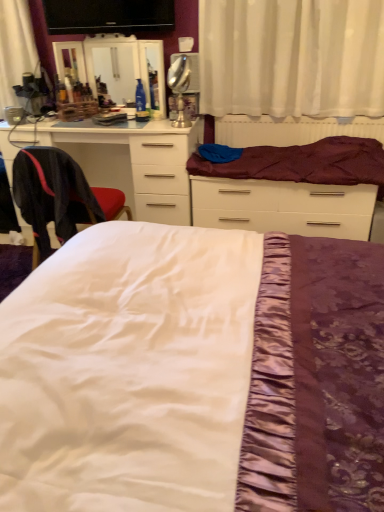
This screenshot has width=384, height=512. What do you see at coordinates (135, 163) in the screenshot? I see `white glossy chest of drawers at left` at bounding box center [135, 163].

Measure the distance between white glossy chest of drawers at left and camera.

2.46 meters.

What is the approximate width of silver metallic table lamp at upper center?

silver metallic table lamp at upper center is 4.65 inches wide.

This screenshot has height=512, width=384. Describe the element at coordinates (179, 87) in the screenshot. I see `silver metallic table lamp at upper center` at that location.

What do you see at coordinates (108, 16) in the screenshot? I see `black glossy flat-screen tv at upper center` at bounding box center [108, 16].

Find the location of `maroon satin mattress at upper center`. maroon satin mattress at upper center is located at coordinates (303, 163).

Is black glossy flat-screen tv at upper center looking in the opposite direction of silver metallic table lamp at upper center?

black glossy flat-screen tv at upper center is not turned away from silver metallic table lamp at upper center.

What's the angular difference between black glossy flat-screen tv at upper center and silver metallic table lamp at upper center's facing directions?

They differ by 62.4 degrees in their facing directions.

Can you confirm if black glossy flat-screen tv at upper center is shorter than silver metallic table lamp at upper center?

Indeed, black glossy flat-screen tv at upper center has a lesser height compared to silver metallic table lamp at upper center.

Between black glossy flat-screen tv at upper center and black fabric chair at left, which one appears on the right side from the viewer's perspective?

From the viewer's perspective, black glossy flat-screen tv at upper center appears more on the right side.

Considering the relative sizes of black glossy flat-screen tv at upper center and black fabric chair at left in the image provided, is black glossy flat-screen tv at upper center thinner than black fabric chair at left?

Correct, the width of black glossy flat-screen tv at upper center is less than that of black fabric chair at left.

Between point (49, 4) and point (36, 158), which one is positioned in front?

The point (36, 158) is closer.

What's the angular difference between silver metallic table lamp at upper center and white satin bed at center, marked as the first bed in a front-to-back arrangement,'s facing directions?

There is a 42.7-degree angle between the facing directions of silver metallic table lamp at upper center and white satin bed at center, marked as the first bed in a front-to-back arrangement.

Does silver metallic table lamp at upper center have a smaller size compared to white satin bed at center, marked as the first bed in a front-to-back arrangement?

Indeed, silver metallic table lamp at upper center has a smaller size compared to white satin bed at center, marked as the first bed in a front-to-back arrangement.

Does point (189, 73) lie in front of point (302, 404)?

No.

Who is more distant, maroon satin mattress at upper center or white sheer curtain at upper center?

maroon satin mattress at upper center is further away from the camera.

Considering the sizes of objects maroon satin mattress at upper center and white sheer curtain at upper center in the image provided, who is taller, maroon satin mattress at upper center or white sheer curtain at upper center?

Standing taller between the two is white sheer curtain at upper center.

Is maroon satin mattress at upper center oriented towards white sheer curtain at upper center?

No.

Is maroon satin mattress at upper center not within white sheer curtain at upper center?

maroon satin mattress at upper center is positioned outside white sheer curtain at upper center.

In the scene shown: From a real-world perspective, which object rests below the other?

From a 3D spatial view, white sheer curtain at upper center is below.

Based on the photo, is white sheer curtain at upper center not within black glossy flat-screen tv at upper center?

white sheer curtain at upper center is positioned outside black glossy flat-screen tv at upper center.

Could you tell me if white sheer curtain at upper center is facing black glossy flat-screen tv at upper center?

No, white sheer curtain at upper center is not oriented towards black glossy flat-screen tv at upper center.

From the image's perspective, does white sheer curtain at upper center appear higher than black glossy flat-screen tv at upper center?

No, from the image's perspective, white sheer curtain at upper center is not over black glossy flat-screen tv at upper center.

Considering the positions of objects black glossy flat-screen tv at upper center and maroon satin mattress at upper center in the image provided, who is behind, black glossy flat-screen tv at upper center or maroon satin mattress at upper center?

black glossy flat-screen tv at upper center.

Identify the location of mattress that appears on the right of black glossy flat-screen tv at upper center. The image size is (384, 512). (303, 163).

In the scene shown: Is maroon satin mattress at upper center inside black glossy flat-screen tv at upper center?

No.

Is point (166, 22) positioned before point (246, 172)?

No.

Can you confirm if black glossy flat-screen tv at upper center is wider than white sheer curtain at upper center?

Incorrect, the width of black glossy flat-screen tv at upper center does not surpass that of white sheer curtain at upper center.

Is black glossy flat-screen tv at upper center positioned before white sheer curtain at upper center?

No, the depth of black glossy flat-screen tv at upper center is greater than that of white sheer curtain at upper center.

Is black glossy flat-screen tv at upper center touching white sheer curtain at upper center?

No, black glossy flat-screen tv at upper center is not making contact with white sheer curtain at upper center.

The height and width of the screenshot is (512, 384). I want to click on curtain below the black glossy flat-screen tv at upper center (from a real-world perspective), so click(292, 57).

You are a GUI agent. You are given a task and a screenshot of the screen. Output one action in this format:
    pyautogui.click(x=<x>, y=<y>)
    Task: Click on the table lamp that is below the black glossy flat-screen tv at upper center (from the image's perspective)
    
    Given the screenshot: What is the action you would take?
    pyautogui.click(x=179, y=87)

Where is `computer monitor behind the black fabric chair at left`? Image resolution: width=384 pixels, height=512 pixels. computer monitor behind the black fabric chair at left is located at coordinates (108, 16).

From the image, which object appears to be farther from white sheer curtain at upper center, maroon satin mattress at upper center or black fabric chair at left?

Based on the image, black fabric chair at left appears to be further to white sheer curtain at upper center.

Looking at the image, which one is located closer to silver metallic table lamp at upper center, white glossy chest of drawers at left or black fabric chair at left?

The object closer to silver metallic table lamp at upper center is white glossy chest of drawers at left.

Based on their spatial positions, is black fabric chair at left or white satin bed at center, which is counted as the second bed, starting from the back, closer to silver metallic table lamp at upper center?

black fabric chair at left is closer to silver metallic table lamp at upper center.

When comparing their distances from black fabric chair at left, does white sheer curtain at upper center or white satin bed at center, marked as the first bed in a front-to-back arrangement, seem closer?

The object closer to black fabric chair at left is white satin bed at center, marked as the first bed in a front-to-back arrangement.

Estimate the real-world distances between objects in this image. Which object is further from purple satin bed at center, placed as the 1th bed when sorted from back to front, white glossy chest of drawers at left or black fabric chair at left?

Among the two, black fabric chair at left is located further to purple satin bed at center, placed as the 1th bed when sorted from back to front.

Looking at the image, which one is located further to black fabric chair at left, black glossy flat-screen tv at upper center or white satin bed at center, marked as the first bed in a front-to-back arrangement?

white satin bed at center, marked as the first bed in a front-to-back arrangement, lies further to black fabric chair at left than the other object.

Based on their spatial positions, is white sheer curtain at upper center or white glossy chest of drawers at left closer to black glossy flat-screen tv at upper center?

Based on the image, white sheer curtain at upper center appears to be nearer to black glossy flat-screen tv at upper center.

From the image, which object appears to be nearer to white sheer curtain at upper center, white glossy chest of drawers at left or black glossy flat-screen tv at upper center?

white glossy chest of drawers at left.

I want to click on table lamp between white satin bed at center, marked as the first bed in a front-to-back arrangement, and black glossy flat-screen tv at upper center from front to back, so click(179, 87).

This screenshot has height=512, width=384. Identify the location of table lamp between black fabric chair at left and maroon satin mattress at upper center in the horizontal direction. (179, 87).

Identify the location of table lamp between black fabric chair at left and purple satin bed at center, placed as the 1th bed when sorted from back to front. The width and height of the screenshot is (384, 512). (179, 87).

Identify the location of chair positioned between white satin bed at center, marked as the first bed in a front-to-back arrangement, and white sheer curtain at upper center from near to far. (59, 197).